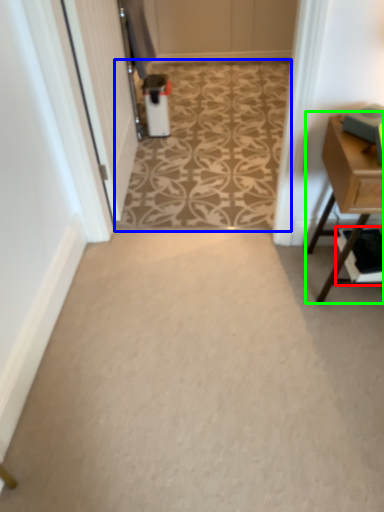
Question: Which object is positioned closest to shelf (highlighted by a red box)? Select from pattern (highlighted by a blue box) and table (highlighted by a green box).

Choices:
 (A) pattern
 (B) table

Answer: (B)